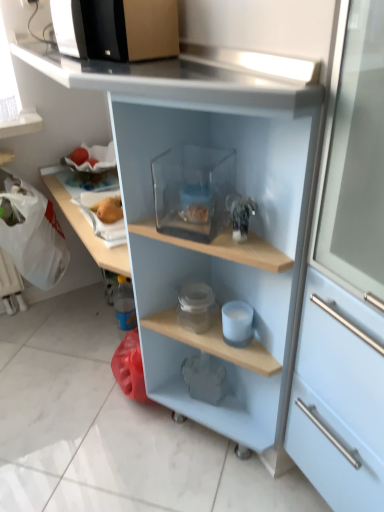
The height and width of the screenshot is (512, 384). What do you see at coordinates (193, 190) in the screenshot?
I see `transparent glass container at center, the 3th appliance when ordered from bottom to top` at bounding box center [193, 190].

Locate an element on the screen. The width and height of the screenshot is (384, 512). transparent glass container at center, the third appliance in the back-to-front sequence is located at coordinates (193, 190).

The width and height of the screenshot is (384, 512). In order to click on transparent glass container at center, the 3th appliance when ordered from bottom to top in this screenshot , I will do `click(193, 190)`.

What's the angular difference between transparent plastic container at center and transparent glass container at center, the third appliance in the back-to-front sequence,'s facing directions?

The facing directions of transparent plastic container at center and transparent glass container at center, the third appliance in the back-to-front sequence, are 33 degrees apart.

The width and height of the screenshot is (384, 512). What are the coordinates of `shelf that is in front of the transparent glass container at center, arranged as the first appliance when viewed from the top` in the screenshot? It's located at 223,229.

Considering the sizes of objects transparent plastic container at center and transparent glass container at center, arranged as the first appliance when viewed from the top, in the image provided, who is bigger, transparent plastic container at center or transparent glass container at center, arranged as the first appliance when viewed from the top,?

With larger size is transparent plastic container at center.

Between transparent plastic container at center and transparent glass container at center, the 3th appliance when ordered from bottom to top, which one appears on the right side from the viewer's perspective?

transparent glass container at center, the 3th appliance when ordered from bottom to top, is more to the right.

Is black plastic microwave at upper left surrounded by white matte cup at center, the second appliance viewed from the back?

No, black plastic microwave at upper left is not surrounded by white matte cup at center, the second appliance viewed from the back.

From the image's perspective, between white matte cup at center, arranged as the second appliance when viewed from the top, and black plastic microwave at upper left, who is located below?

white matte cup at center, arranged as the second appliance when viewed from the top, appears lower in the image.

Is white matte cup at center, which is the second appliance in front-to-back order, not near black plastic microwave at upper left?

No, white matte cup at center, which is the second appliance in front-to-back order, is not far away from black plastic microwave at upper left.

Consider the image. Is white matte cup at center, arranged as the second appliance when viewed from the top, smaller than black plastic microwave at upper left?

Indeed, white matte cup at center, arranged as the second appliance when viewed from the top, has a smaller size compared to black plastic microwave at upper left.

From the image's perspective, is black plastic microwave at upper left above or below transparent plastic container at center?

black plastic microwave at upper left is situated higher than transparent plastic container at center in the image.

Locate an element on the screen. The image size is (384, 512). shelf that appears in front of the black plastic microwave at upper left is located at coordinates (223, 229).

Is black plastic microwave at upper left behind transparent plastic container at center?

Yes, it is behind transparent plastic container at center.

In the scene shown: Considering the sizes of objects black plastic microwave at upper left and transparent plastic container at center in the image provided, who is shorter, black plastic microwave at upper left or transparent plastic container at center?

black plastic microwave at upper left is shorter.

Is point (160, 227) positioned in front of point (227, 247)?

No.

From the image's perspective, is transparent glass container at center, arranged as the first appliance when viewed from the top, beneath transparent plastic container at center?

No.

Is transparent glass container at center, marked as the 1th appliance in a front-to-back arrangement, to the left of transparent plastic container at center from the viewer's perspective?

No, transparent glass container at center, marked as the 1th appliance in a front-to-back arrangement, is not to the left of transparent plastic container at center.

How different are the orientations of transparent glass container at center, the third appliance in the back-to-front sequence, and transparent plastic container at center in degrees?

The angle between the facing direction of transparent glass container at center, the third appliance in the back-to-front sequence, and the facing direction of transparent plastic container at center is 33 degrees.

Can you confirm if matte gray elephant at lower center, the 1th appliance in the bottom-to-top sequence, is thinner than transparent glass container at center, the 3th appliance when ordered from bottom to top?

Yes, matte gray elephant at lower center, the 1th appliance in the bottom-to-top sequence, is thinner than transparent glass container at center, the 3th appliance when ordered from bottom to top.

Can you confirm if matte gray elephant at lower center, which is counted as the 1th appliance, starting from the back, is smaller than transparent glass container at center, marked as the 1th appliance in a front-to-back arrangement?

Correct, matte gray elephant at lower center, which is counted as the 1th appliance, starting from the back, occupies less space than transparent glass container at center, marked as the 1th appliance in a front-to-back arrangement.

Are matte gray elephant at lower center, which is counted as the 1th appliance, starting from the back, and transparent glass container at center, marked as the 1th appliance in a front-to-back arrangement, located far from each other?

No, there isn't a large distance between matte gray elephant at lower center, which is counted as the 1th appliance, starting from the back, and transparent glass container at center, marked as the 1th appliance in a front-to-back arrangement.

From the image's perspective, between matte gray elephant at lower center, which ranks as the third appliance in front-to-back order, and transparent glass container at center, the third appliance in the back-to-front sequence, who is located below?

From the image's view, matte gray elephant at lower center, which ranks as the third appliance in front-to-back order, is below.

Which is more to the left, transparent plastic container at center or black plastic microwave at upper left?

Positioned to the left is black plastic microwave at upper left.

Which object is further away from the camera, transparent plastic container at center or black plastic microwave at upper left?

black plastic microwave at upper left is further away from the camera.

Does transparent plastic container at center touch black plastic microwave at upper left?

No.

How much distance is there between transparent plastic container at center and white matte cup at center, the second appliance viewed from the back?

12.01 inches.

Is point (251, 239) farther from camera compared to point (240, 302)?

No, (251, 239) is closer to viewer.

From a real-world perspective, is transparent plastic container at center on white matte cup at center, which is the 2th appliance in bottom-to-top order?

Yes.

The image size is (384, 512). I want to click on appliance above the transparent plastic container at center (from the image's perspective), so click(193, 190).

The height and width of the screenshot is (512, 384). Identify the location of microwave oven above the white matte cup at center, which is the 2th appliance in bottom-to-top order (from a real-world perspective). (116, 29).

Based on the photo, looking at the image, which one is located further to transparent glass container at center, marked as the 1th appliance in a front-to-back arrangement, white matte cup at center, arranged as the second appliance when viewed from the top, or yellow matte apple at upper left?

Among the two, yellow matte apple at upper left is located further to transparent glass container at center, marked as the 1th appliance in a front-to-back arrangement.

From the image, which object appears to be farther from black plastic microwave at upper left, transparent plastic container at center or yellow matte apple at upper left?

Based on the image, yellow matte apple at upper left appears to be further to black plastic microwave at upper left.

Consider the image. From the image, which object appears to be nearer to matte gray elephant at lower center, which is counted as the 1th appliance, starting from the back, transparent glass container at center, the 3th appliance when ordered from bottom to top, or black plastic microwave at upper left?

The object closer to matte gray elephant at lower center, which is counted as the 1th appliance, starting from the back, is transparent glass container at center, the 3th appliance when ordered from bottom to top.

Based on their spatial positions, is transparent plastic container at center or black plastic microwave at upper left closer to yellow matte apple at upper left?

transparent plastic container at center lies closer to yellow matte apple at upper left than the other object.

Estimate the real-world distances between objects in this image. Which object is closer to black plastic microwave at upper left, yellow matte apple at upper left or white matte cup at center, the second appliance viewed from the back?

Based on the image, yellow matte apple at upper left appears to be nearer to black plastic microwave at upper left.

Which object lies further to the anchor point black plastic microwave at upper left, transparent glass container at center, arranged as the first appliance when viewed from the top, or matte gray elephant at lower center, which is the third appliance in top-to-bottom order?

matte gray elephant at lower center, which is the third appliance in top-to-bottom order, is further to black plastic microwave at upper left.

When comparing their distances from white matte cup at center, arranged as the second appliance when viewed from the top, does transparent glass container at center, the 3th appliance when ordered from bottom to top, or transparent plastic container at center seem closer?

The object closer to white matte cup at center, arranged as the second appliance when viewed from the top, is transparent plastic container at center.

Based on their spatial positions, is yellow matte apple at upper left or black plastic microwave at upper left further from transparent plastic container at center?

The object further to transparent plastic container at center is yellow matte apple at upper left.

In order to click on food that lies between black plastic microwave at upper left and white matte cup at center, which is the 2th appliance in bottom-to-top order, from top to bottom in this screenshot , I will do `click(108, 209)`.

At what (x,y) coordinates should I click in order to perform the action: click on appliance between black plastic microwave at upper left and transparent plastic container at center from top to bottom. Please return your answer as a coordinate pair (x, y). This screenshot has width=384, height=512. Looking at the image, I should click on (193, 190).

Where is `shelf between black plastic microwave at upper left and white matte cup at center, which is the second appliance in front-to-back order, in the vertical direction`? shelf between black plastic microwave at upper left and white matte cup at center, which is the second appliance in front-to-back order, in the vertical direction is located at coordinates (223, 229).

Locate an element on the screen. This screenshot has height=512, width=384. appliance between black plastic microwave at upper left and white matte cup at center, arranged as the second appliance when viewed from the top, in the up-down direction is located at coordinates (193, 190).